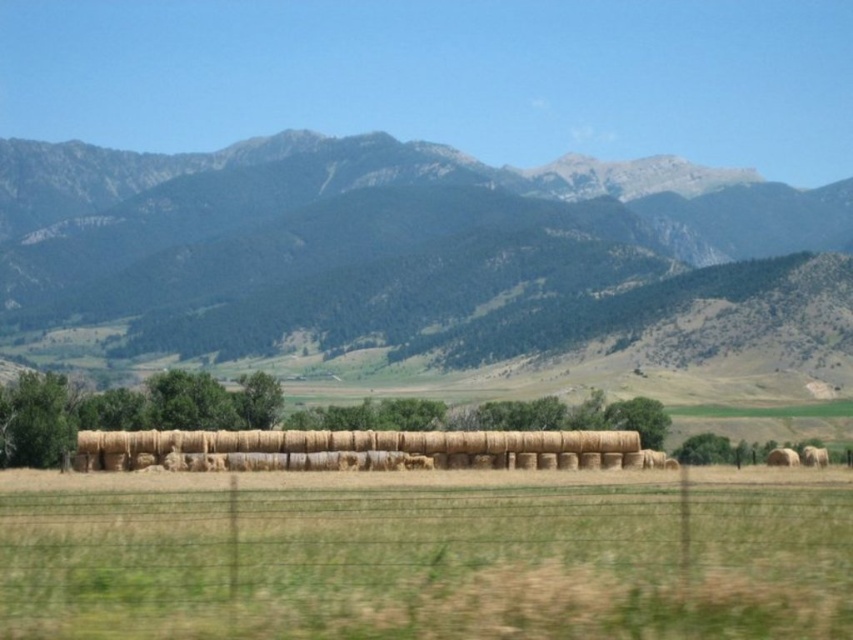
Question: Can you confirm if green textured mountain range at upper center is positioned above brown straw bales at center?

Choices:
 (A) no
 (B) yes

Answer: (B)

Question: Estimate the real-world distances between objects in this image. Which object is farther from the green textured mountain range at upper center?

Choices:
 (A) brown straw bales at center
 (B) golden straw bales at center

Answer: (B)

Question: Does green textured mountain range at upper center have a smaller size compared to golden straw bales at center?

Choices:
 (A) no
 (B) yes

Answer: (A)

Question: Which point is farther to the camera?

Choices:
 (A) [x=614, y=433]
 (B) [x=310, y=524]

Answer: (A)

Question: Which is nearer to the golden straw bales at center?

Choices:
 (A) brown straw bales at center
 (B) green textured mountain range at upper center

Answer: (A)

Question: Does green textured mountain range at upper center appear under golden straw bales at center?

Choices:
 (A) yes
 (B) no

Answer: (B)